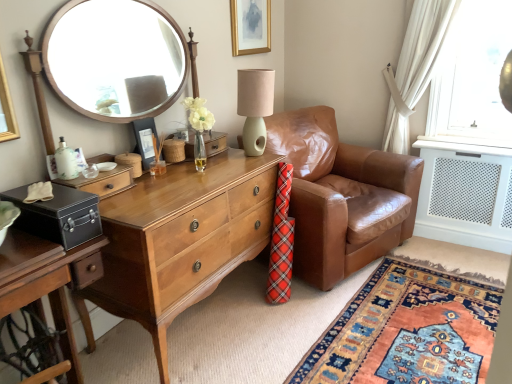
Image resolution: width=512 pixels, height=384 pixels. In order to click on empty space that is ontop of matte brown drawer at center (from a real-world perspective) in this screenshot , I will do `click(94, 170)`.